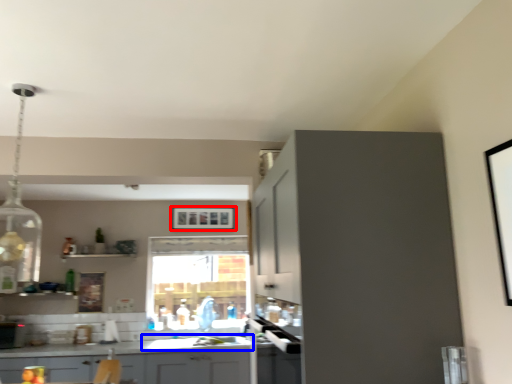
Question: Which of the following is the farthest to the observer, picture frame (highlighted by a red box) or sink (highlighted by a blue box)?

Choices:
 (A) picture frame
 (B) sink

Answer: (A)